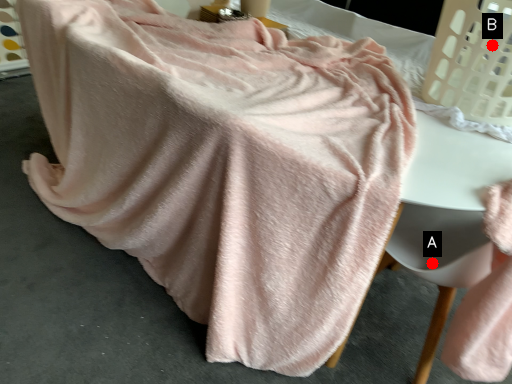
Question: Two points are circled on the image, labeled by A and B beside each circle. Which point appears closest to the camera in this image?

Choices:
 (A) A is closer
 (B) B is closer

Answer: (B)